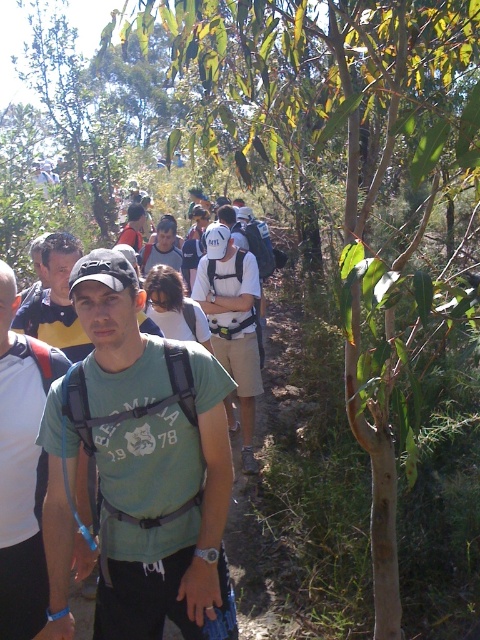
You are a photographer standing at the back of the hiking group. You want to take a photo of both the green fabric shirt at center and the matte gray shirt at center. Which shirt will appear larger in your photo?

The green fabric shirt at center will appear larger in the photo because it is closer to the viewer than the matte gray shirt at center.

You are a hiker looking at the image of the forest path. There is a point marked at coordinates (21, 468). What object in the scene is located at that point?

The point at coordinates (21, 468) corresponds to the green fabric shirt at center.